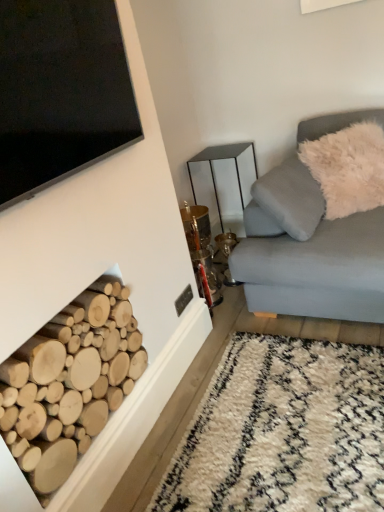
Question: Are white shaggy rug at lower right and white fluffy pillow at upper right making contact?

Choices:
 (A) yes
 (B) no

Answer: (B)

Question: Can you confirm if white shaggy rug at lower right is taller than white fluffy pillow at upper right?

Choices:
 (A) yes
 (B) no

Answer: (B)

Question: From the image's perspective, would you say white shaggy rug at lower right is positioned over white fluffy pillow at upper right?

Choices:
 (A) no
 (B) yes

Answer: (A)

Question: Is white shaggy rug at lower right far from white fluffy pillow at upper right?

Choices:
 (A) no
 (B) yes

Answer: (B)

Question: Can you confirm if white shaggy rug at lower right is thinner than white fluffy pillow at upper right?

Choices:
 (A) no
 (B) yes

Answer: (A)

Question: From the image's perspective, relative to metallic mirrored table at center, is white fluffy pillow at upper right above or below?

Choices:
 (A) above
 (B) below

Answer: (A)

Question: From their relative heights in the image, would you say white fluffy pillow at upper right is taller or shorter than metallic mirrored table at center?

Choices:
 (A) short
 (B) tall

Answer: (A)

Question: Would you say white fluffy pillow at upper right is to the left or to the right of metallic mirrored table at center in the picture?

Choices:
 (A) left
 (B) right

Answer: (B)

Question: Relative to metallic mirrored table at center, is white fluffy pillow at upper right in front or behind?

Choices:
 (A) behind
 (B) front

Answer: (B)

Question: Is metallic mirrored table at center wider or thinner than white fluffy pillow at upper right?

Choices:
 (A) wide
 (B) thin

Answer: (A)

Question: Is metallic mirrored table at center situated inside white fluffy pillow at upper right or outside?

Choices:
 (A) outside
 (B) inside

Answer: (A)

Question: From a real-world perspective, is metallic mirrored table at center physically located above or below white fluffy pillow at upper right?

Choices:
 (A) below
 (B) above

Answer: (A)

Question: Does point (238, 179) appear closer or farther from the camera than point (302, 144)?

Choices:
 (A) closer
 (B) farther

Answer: (B)

Question: From a real-world perspective, is white fluffy pillow at upper right physically located above or below white shaggy rug at lower right?

Choices:
 (A) above
 (B) below

Answer: (A)

Question: Considering the positions of white fluffy pillow at upper right and white shaggy rug at lower right in the image, is white fluffy pillow at upper right bigger or smaller than white shaggy rug at lower right?

Choices:
 (A) big
 (B) small

Answer: (A)